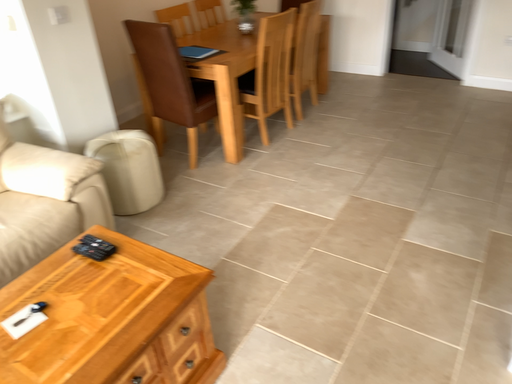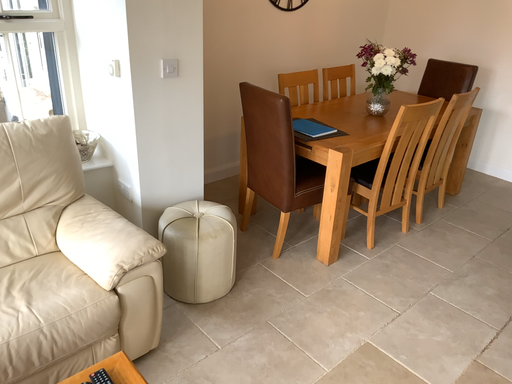
Question: How did the camera likely rotate when shooting the video?

Choices:
 (A) rotated downward
 (B) rotated upward

Answer: (B)